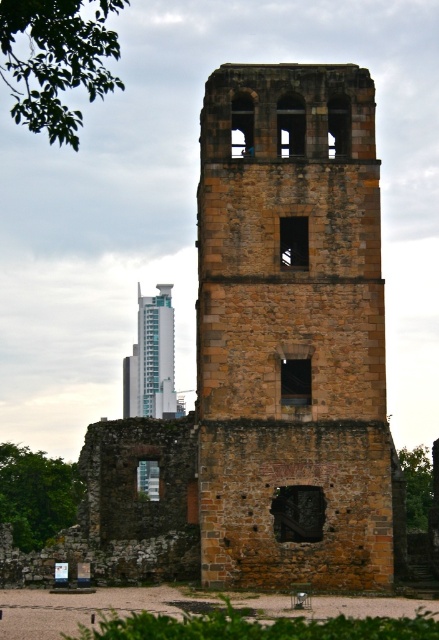
You are a city planner assessing the impact of new construction on historical landmarks. You notice the green leafy tree at upper left and the teal glass skyscraper at center. Which structure would cast a longer shadow during midday in summer? Please explain your reasoning based on their heights.

The green leafy tree at upper left is much taller than the teal glass skyscraper at center, so it would cast a longer shadow during midday in summer.

You are a drone operator tasked with flying a drone from the green leafy tree at upper left to the teal glass skyscraper at center. Given that your drone has a maximum flight range of 20 meters, can it successfully reach the skyscraper from the tree?

The distance between the green leafy tree at upper left and the teal glass skyscraper at center is 20.88 meters, which exceeds the drone operator s maximum flight range of 20 meters. Therefore, the drone cannot successfully reach the teal glass skyscraper at center from the green leafy tree at upper left.